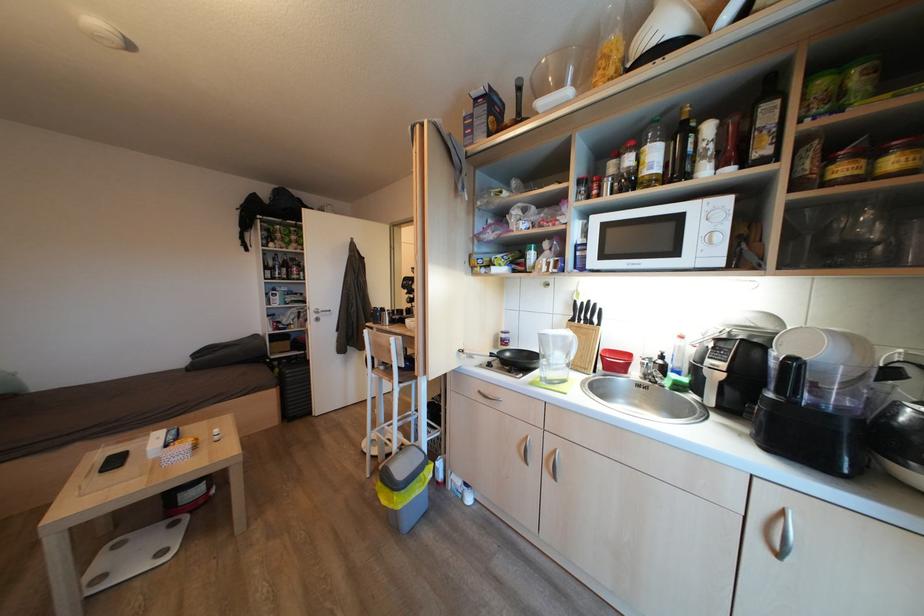
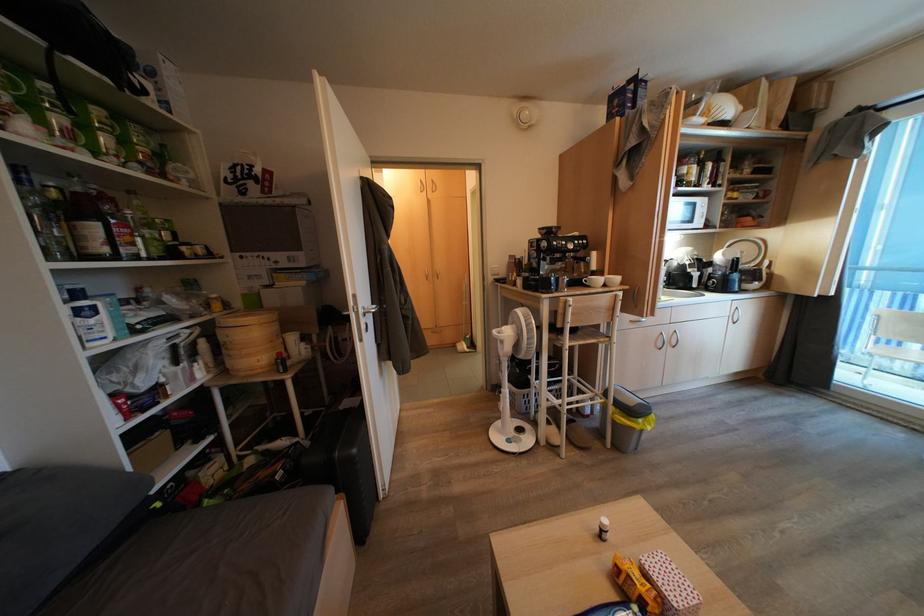
Find the pixel in the second image that matches (x=283, y=301) in the first image.

(108, 321)